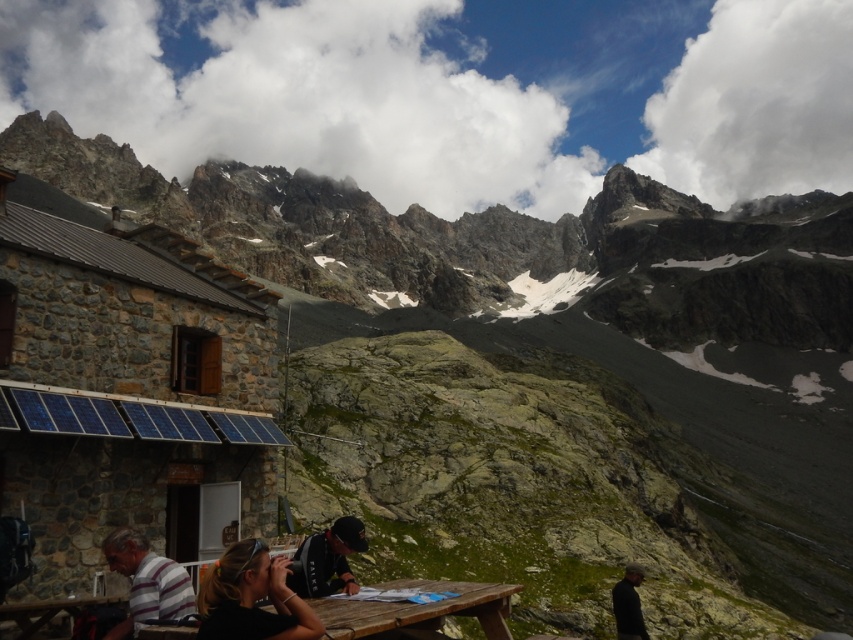
Question: Which of these objects is positioned closest to the black fabric shirt at lower left?

Choices:
 (A) black fabric at center
 (B) black hair at lower center
 (C) wooden picnic table at lower center
 (D) striped cotton shirt at lower left

Answer: (B)

Question: Which of these objects is positioned farthest from the black fabric at lower right?

Choices:
 (A) striped cotton shirt at lower left
 (B) black fabric shirt at lower left
 (C) wooden picnic table at lower center
 (D) black fabric at center

Answer: (A)

Question: Does striped cotton shirt at lower left lie behind black fabric at lower right?

Choices:
 (A) no
 (B) yes

Answer: (A)

Question: Is black fabric shirt at lower left positioned in front of wooden picnic table at lower center?

Choices:
 (A) yes
 (B) no

Answer: (A)

Question: Considering the real-world distances, which object is farthest from the black fabric shirt at lower left?

Choices:
 (A) black fabric at lower right
 (B) striped cotton shirt at lower left
 (C) black fabric at center
 (D) wooden picnic table at lower center

Answer: (A)

Question: Does black hair at lower center have a larger size compared to black fabric at center?

Choices:
 (A) no
 (B) yes

Answer: (B)